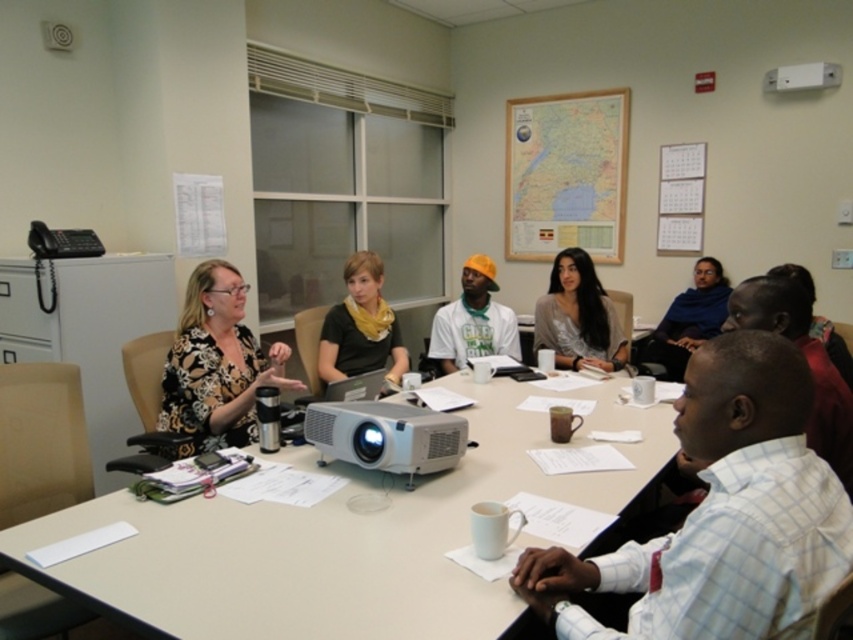
Does white plastic table at center appear over floral-patterned blouse at center?

No, white plastic table at center is not above floral-patterned blouse at center.

What do you see at coordinates (341, 538) in the screenshot? I see `white plastic table at center` at bounding box center [341, 538].

The width and height of the screenshot is (853, 640). Identify the location of white plastic table at center. (341, 538).

Describe the element at coordinates (216, 365) in the screenshot. I see `floral-patterned blouse at center` at that location.

Between floral-patterned blouse at center and white plastic projector at center, which one is positioned higher?

floral-patterned blouse at center is above.

I want to click on floral-patterned blouse at center, so pyautogui.click(x=216, y=365).

The image size is (853, 640). I want to click on floral-patterned blouse at center, so click(216, 365).

How distant is floral-patterned blouse at center from shiny silver blouse at center?

The distance of floral-patterned blouse at center from shiny silver blouse at center is 5.50 feet.

In the scene shown: Who is more distant from viewer, (189,387) or (604,317)?

The point (604,317) is behind.

Where is `floral-patterned blouse at center`? floral-patterned blouse at center is located at coordinates (216, 365).